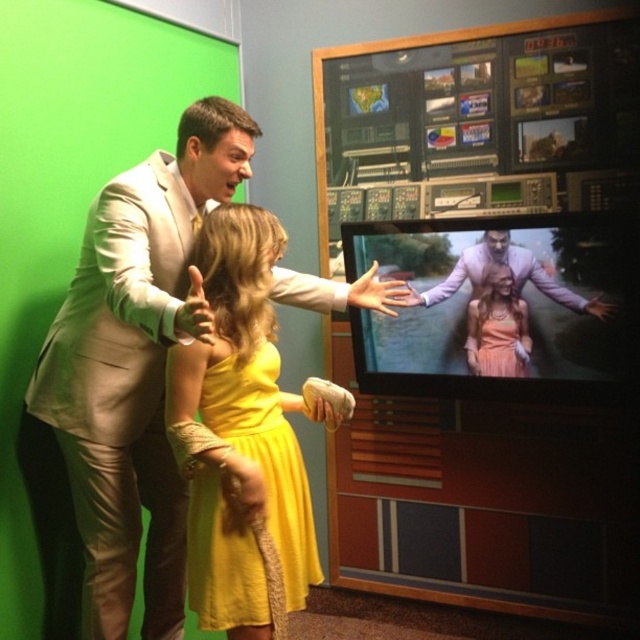
Who is more distant from viewer, (268, 428) or (472, 321)?

Positioned behind is point (472, 321).

Between yellow satin dress at center and pink satin dress at center, which one has less height?

pink satin dress at center

Is point (291, 456) closer to camera compared to point (508, 346)?

Yes, it is in front of point (508, 346).

The width and height of the screenshot is (640, 640). What are the coordinates of `yellow satin dress at center` in the screenshot? It's located at (266, 458).

Between yellow satin dress at center and matte purple suit at center, which one has more height?

yellow satin dress at center is taller.

Is the position of yellow satin dress at center less distant than that of matte purple suit at center?

Yes, it is.

You are a GUI agent. You are given a task and a screenshot of the screen. Output one action in this format:
    pyautogui.click(x=<x>, y=<y>)
    Task: Click on the yellow satin dress at center
    
    Given the screenshot: What is the action you would take?
    pyautogui.click(x=266, y=458)

This screenshot has height=640, width=640. Find the location of `yellow satin dress at center`. yellow satin dress at center is located at coordinates (266, 458).

Consider the image. Is satin silver suit at upper left wider than pink satin dress at center?

Indeed, satin silver suit at upper left has a greater width compared to pink satin dress at center.

Based on the photo, is satin silver suit at upper left below pink satin dress at center?

Indeed, satin silver suit at upper left is positioned under pink satin dress at center.

This screenshot has width=640, height=640. Describe the element at coordinates (134, 365) in the screenshot. I see `satin silver suit at upper left` at that location.

Identify the location of satin silver suit at upper left. The image size is (640, 640). (134, 365).